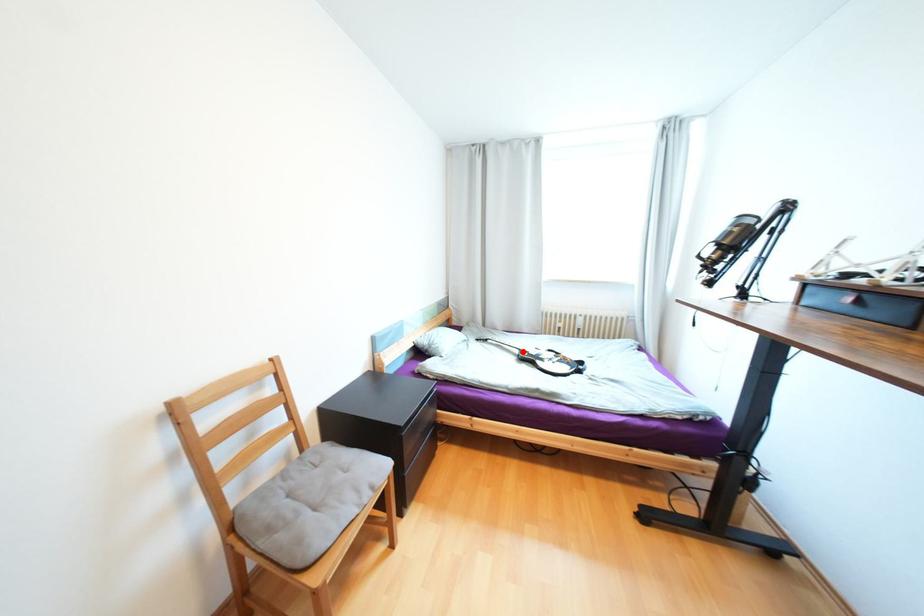
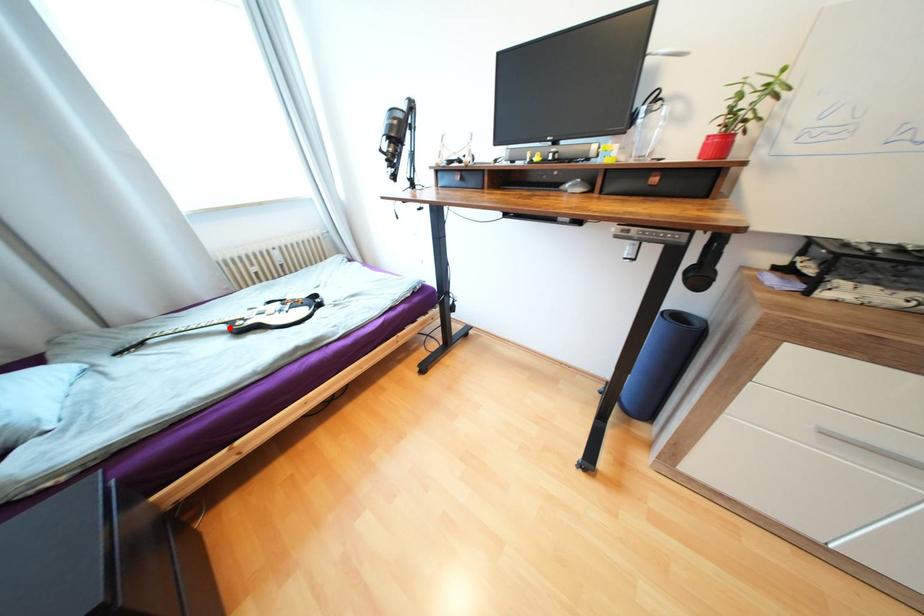
I am providing you with two images of the same scene from different viewpoints. A red point is marked on the first image and another point is marked on the second image. Is the red point in image1 aligned with the point shown in image2?

Yes